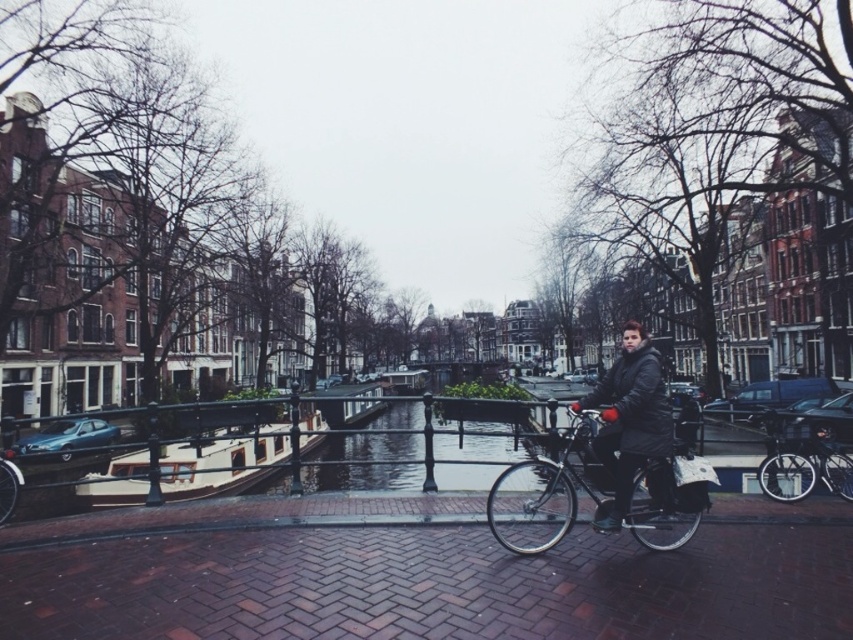
Between shiny black bicycle at center and black matte jacket at center, which one has more height?

Standing taller between the two is black matte jacket at center.

Between shiny black bicycle at center and black matte jacket at center, which one appears on the right side from the viewer's perspective?

Positioned to the right is black matte jacket at center.

Is point (647, 500) positioned in front of point (622, 509)?

No.

Where is `shiny black bicycle at center`? The width and height of the screenshot is (853, 640). shiny black bicycle at center is located at coordinates [x=549, y=490].

At what (x,y) coordinates should I click in order to perform the action: click on clear glass waterway at center. Please return your answer as a coordinate pair (x, y). This screenshot has height=640, width=853. Looking at the image, I should click on (373, 454).

Who is more distant from viewer, (335, 465) or (619, 385)?

The point (335, 465) is behind.

Where is `clear glass waterway at center`? clear glass waterway at center is located at coordinates (373, 454).

Does clear glass waterway at center come in front of shiny metallic bicycle at center?

No, it is behind shiny metallic bicycle at center.

Who is more distant from viewer, [389,438] or [775,422]?

The point [389,438] is more distant.

This screenshot has height=640, width=853. In order to click on clear glass waterway at center in this screenshot , I will do `click(373, 454)`.